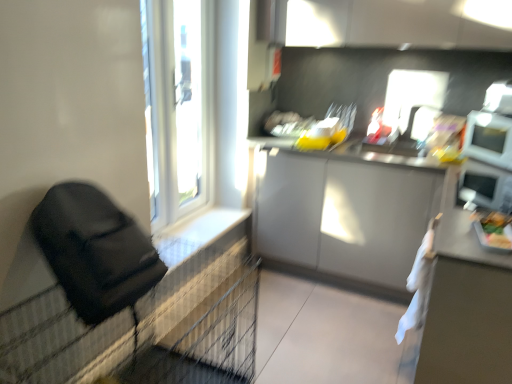
This screenshot has width=512, height=384. Find the location of `vacant space situated above white matte table at right (from a real-world perspective)`. vacant space situated above white matte table at right (from a real-world perspective) is located at coordinates (482, 227).